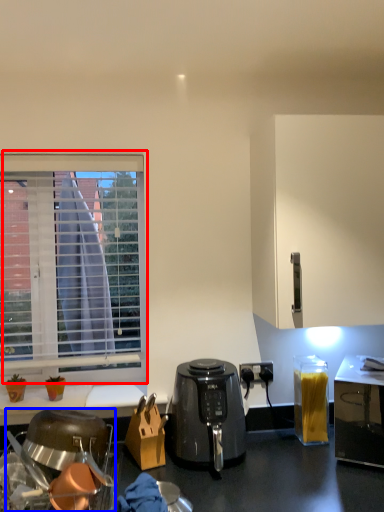
Question: Which object appears closest to the camera in this image, window (highlighted by a red box) or kitchen appliance (highlighted by a blue box)?

Choices:
 (A) window
 (B) kitchen appliance

Answer: (B)